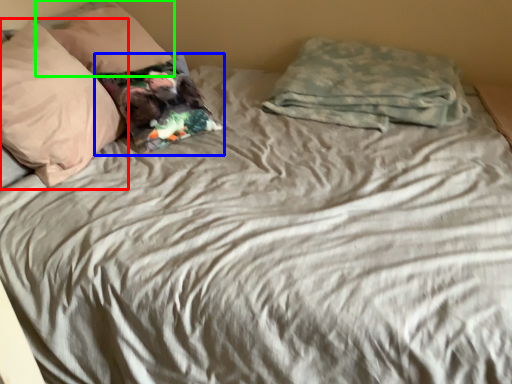
Question: Based on their relative distances, which object is nearer to pillow (highlighted by a red box)? Choose from pillow (highlighted by a blue box) and pillow (highlighted by a green box).

Choices:
 (A) pillow
 (B) pillow

Answer: (A)